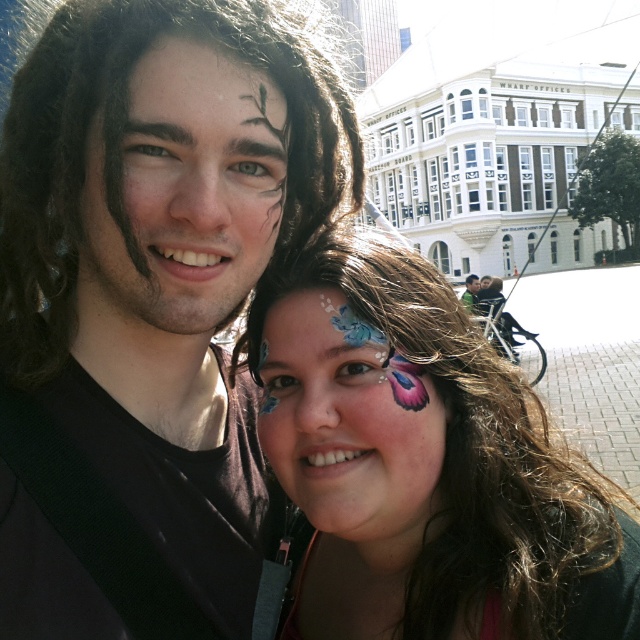
You are a photographer reviewing the image. You need to determine if the matte face paint butterfly at center can be fully captured in a closeup shot that currently frames the matte black face paint at upper left. Can it fit without cropping?

The matte face paint butterfly at center might be wider than the matte black face paint at upper left, so it may not fit fully in the closeup shot framed for the matte black face paint at upper left without cropping.